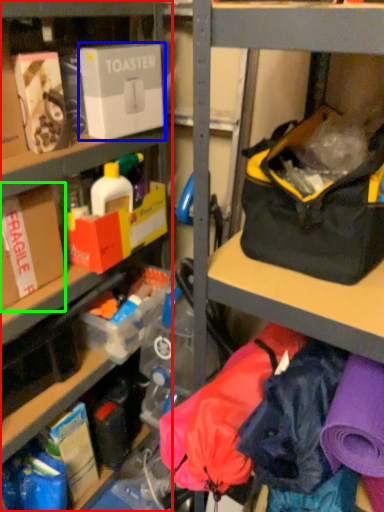
Question: Which is farther away from shelf (highlighted by a red box)? box (highlighted by a blue box) or box (highlighted by a green box)?

Choices:
 (A) box
 (B) box

Answer: (B)